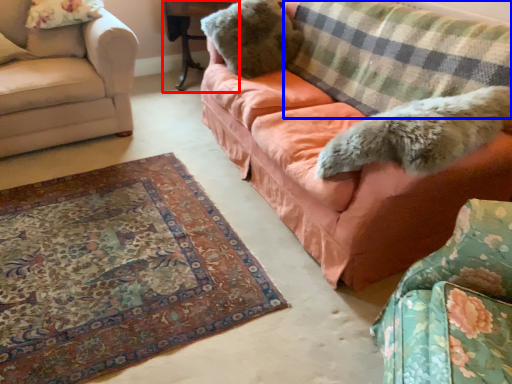
Question: Among these objects, which one is nearest to the camera, table (highlighted by a red box) or plaid (highlighted by a blue box)?

Choices:
 (A) table
 (B) plaid

Answer: (B)